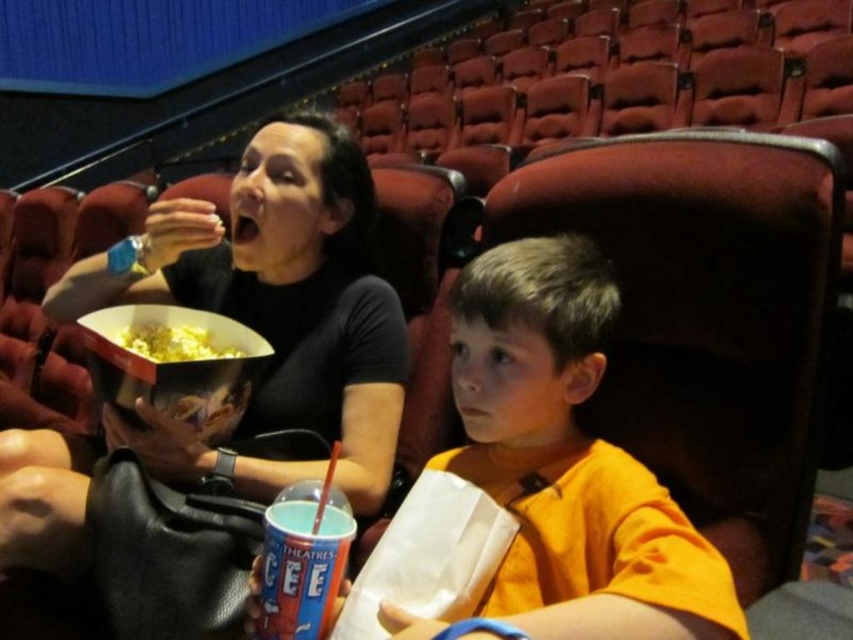
Question: Does blue plastic cup at lower center have a greater width compared to yellow popcorn at center?

Choices:
 (A) no
 (B) yes

Answer: (A)

Question: Among these points, which one is nearest to the camera?

Choices:
 (A) (212, 349)
 (B) (326, 545)
 (C) (263, 307)
 (D) (613, 291)

Answer: (B)

Question: Which of the following is the farthest from the observer?

Choices:
 (A) (128, 428)
 (B) (595, 588)

Answer: (A)

Question: Is matte black popcorn bucket at center positioned at the back of orange cotton shirt at center?

Choices:
 (A) yes
 (B) no

Answer: (A)

Question: Is orange cotton shirt at center positioned behind yellow popcorn at center?

Choices:
 (A) no
 (B) yes

Answer: (A)

Question: Which object is farther from the camera taking this photo?

Choices:
 (A) blue plastic cup at lower center
 (B) orange cotton shirt at center
 (C) yellow popcorn at center

Answer: (C)